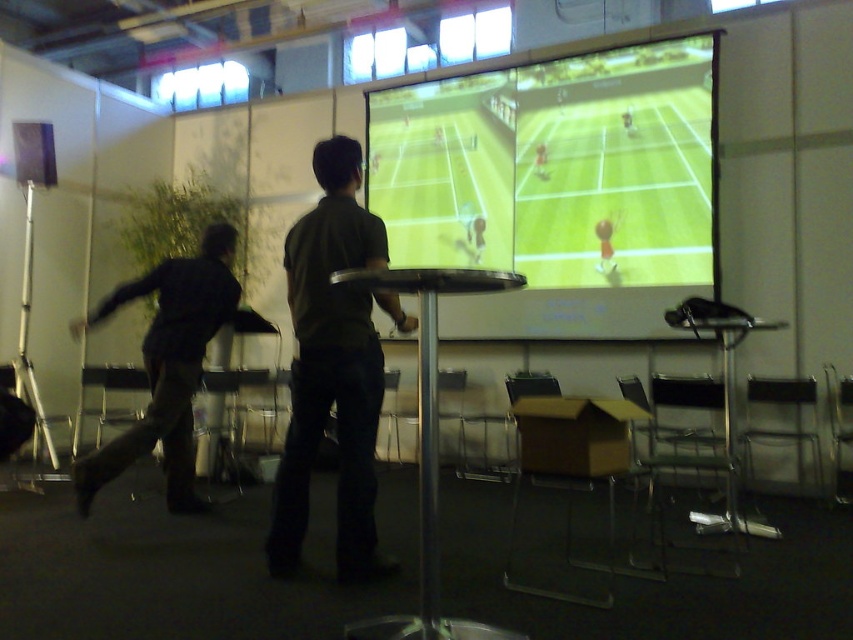
Who is positioned more to the right, dark green shirt at center or black matte pants at left?

Positioned to the right is dark green shirt at center.

The image size is (853, 640). What do you see at coordinates (334, 368) in the screenshot?
I see `dark green shirt at center` at bounding box center [334, 368].

I want to click on dark green shirt at center, so coord(334,368).

Who is positioned more to the left, green matte tennis court at center or dark green shirt at center?

Positioned to the left is dark green shirt at center.

Is green matte tennis court at center to the right of dark green shirt at center from the viewer's perspective?

Correct, you'll find green matte tennis court at center to the right of dark green shirt at center.

Image resolution: width=853 pixels, height=640 pixels. What do you see at coordinates (556, 182) in the screenshot?
I see `green matte tennis court at center` at bounding box center [556, 182].

Locate an element on the screen. The image size is (853, 640). green matte tennis court at center is located at coordinates (556, 182).

Based on the photo, which is more to the left, green matte tennis court at center or black matte pants at left?

black matte pants at left

Does green matte tennis court at center have a greater width compared to black matte pants at left?

Yes, green matte tennis court at center is wider than black matte pants at left.

Is point (428, 102) farther from viewer compared to point (207, 275)?

Yes.

Identify the location of green matte tennis court at center. (556, 182).